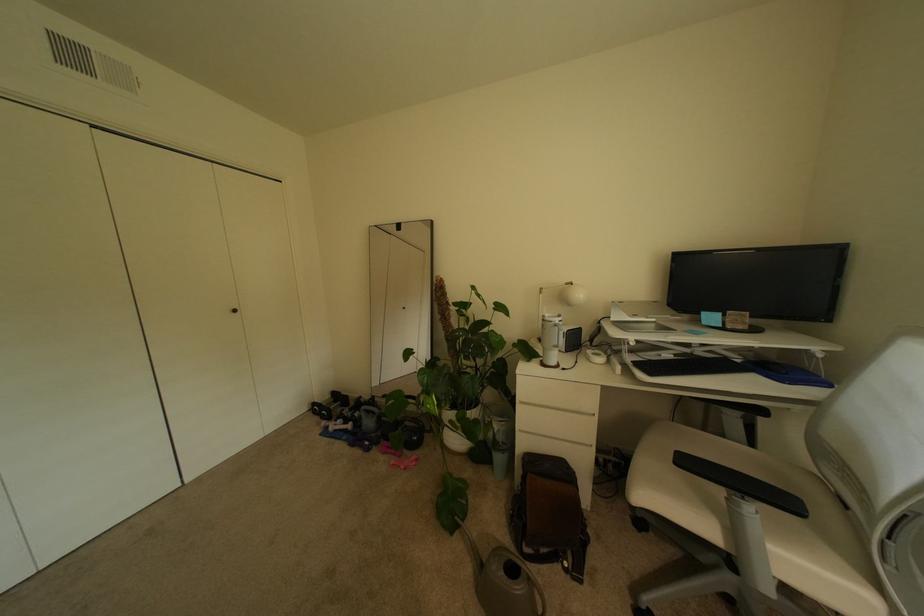
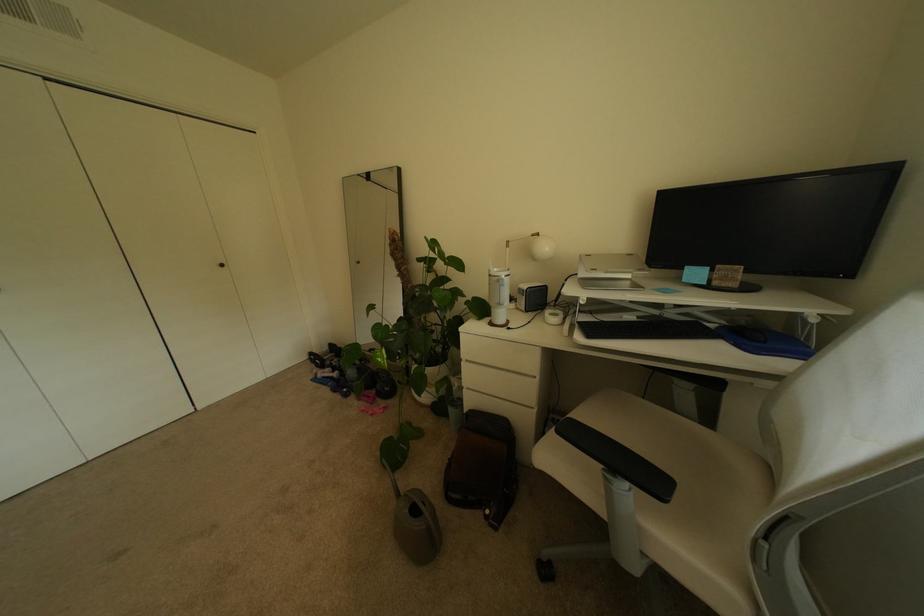
Question: How did the camera likely rotate?

Choices:
 (A) Left
 (B) Right
 (C) Up
 (D) Down

Answer: (D)